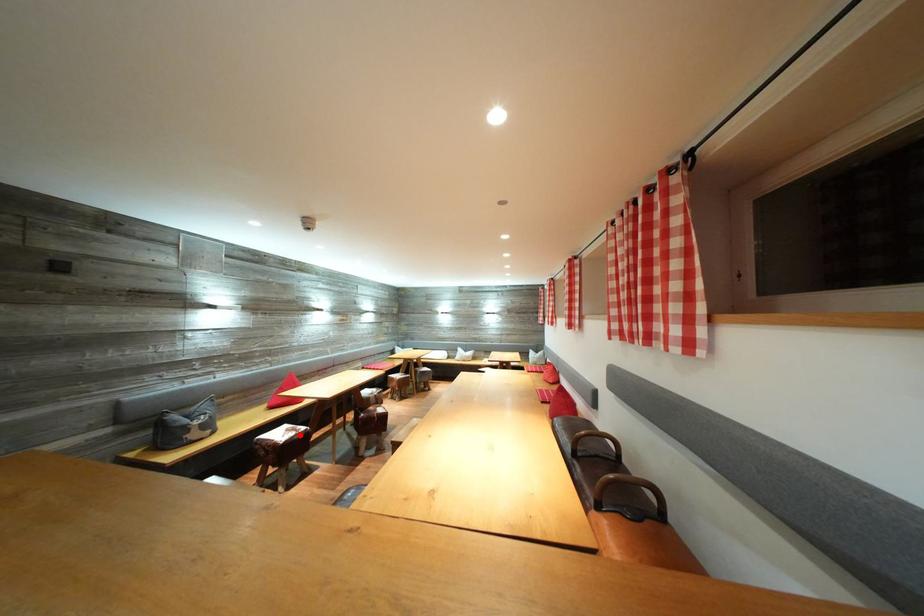
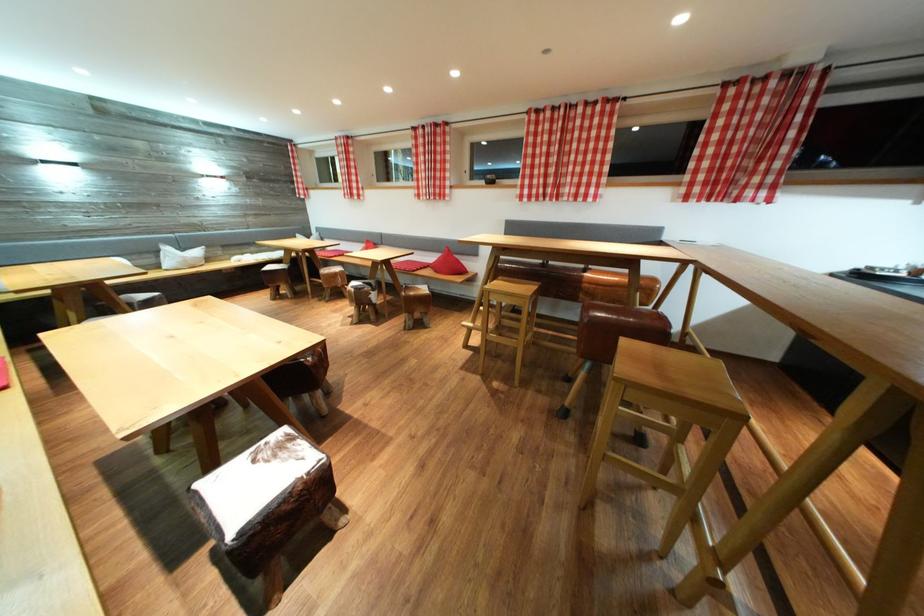
Question: I am providing you with two images of the same scene from different viewpoints. Given a red point in image1, look at the same physical point in image2. Is it:

Choices:
 (A) Closer to the viewpoint
 (B) Farther from the viewpoint

Answer: (A)